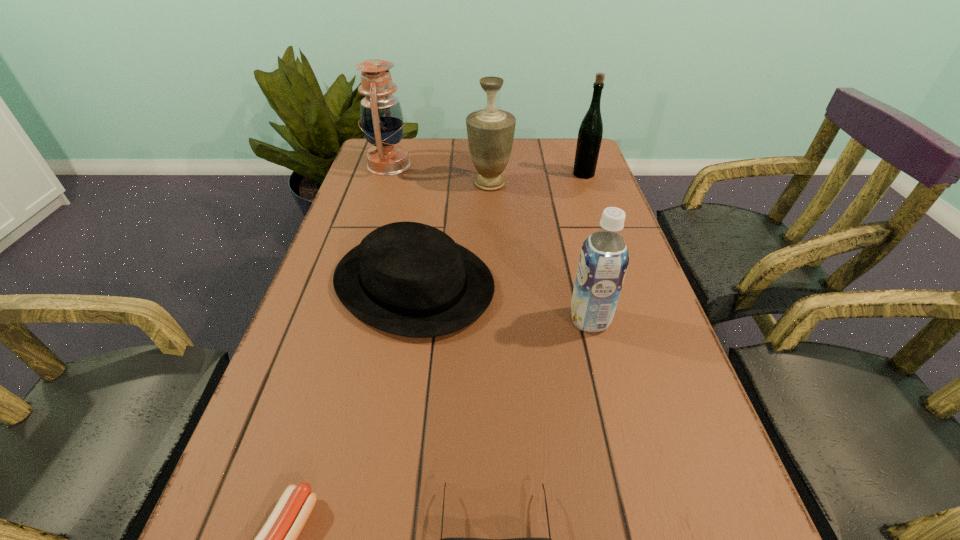
Identify the location of free spot located on the label of the sixth object from left to right. Image resolution: width=960 pixels, height=540 pixels. (463, 320).

Where is `free space located on the right of the fedora`? free space located on the right of the fedora is located at coordinates (647, 283).

This screenshot has height=540, width=960. Find the location of `oil lamp that is at the far edge`. oil lamp that is at the far edge is located at coordinates (381, 116).

The height and width of the screenshot is (540, 960). I want to click on urn at the far edge, so click(x=490, y=131).

Where is `beer bottle located at the far edge`? beer bottle located at the far edge is located at coordinates (590, 133).

Locate an element on the screen. oil lamp present at the left edge is located at coordinates (381, 116).

Locate an element on the screen. This screenshot has width=960, height=540. fedora positioned at the left edge is located at coordinates (410, 279).

At what (x,y) coordinates should I click in order to perform the action: click on beer bottle at the right edge. Please return your answer as a coordinate pair (x, y). The image size is (960, 540). Looking at the image, I should click on (590, 133).

The width and height of the screenshot is (960, 540). I want to click on soya milk that is at the right edge, so click(x=604, y=257).

Where is `object positioned at the far left corner`? object positioned at the far left corner is located at coordinates (381, 116).